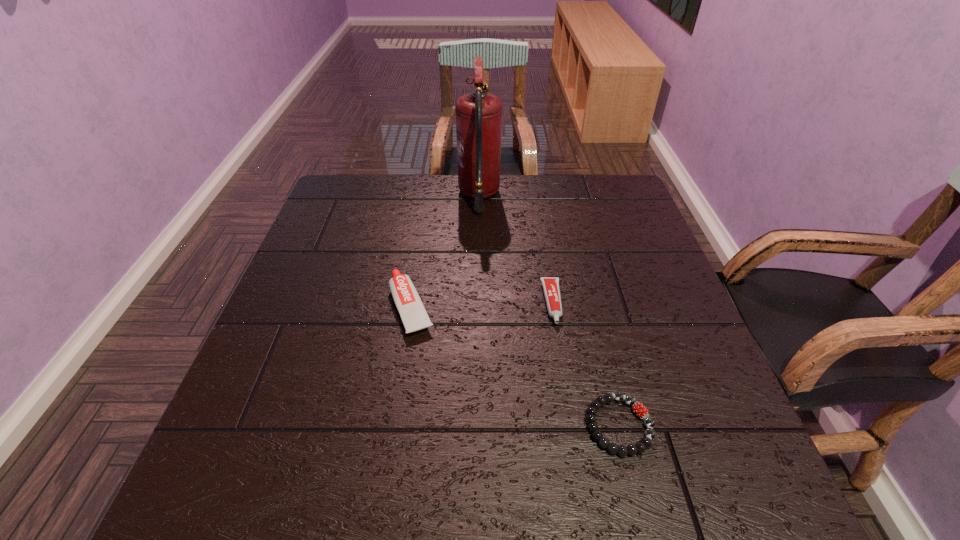
Find the location of a particular element. This screenshot has height=540, width=960. vacant region at the far left corner of the desktop is located at coordinates (326, 213).

In the image, there is a desktop. Find the location of `free space at the far right corner`. free space at the far right corner is located at coordinates tap(615, 191).

The height and width of the screenshot is (540, 960). Identify the location of empty location between the leftmost object and the farthest object. (445, 251).

I want to click on empty location between the third tallest object and the rightmost object, so click(x=586, y=364).

Image resolution: width=960 pixels, height=540 pixels. I want to click on free space between the nearest object and the second tallest object, so click(x=516, y=366).

Locate an element on the screen. vacant region between the rightmost object and the right toothpaste is located at coordinates point(586,364).

The width and height of the screenshot is (960, 540). Find the location of `free space between the nearest object and the third tallest object`. free space between the nearest object and the third tallest object is located at coordinates (586, 364).

Where is `free space that is in between the third shortest object and the third object from right to left`? free space that is in between the third shortest object and the third object from right to left is located at coordinates (445, 251).

Where is `free area in between the farthest object and the third tallest object`? The width and height of the screenshot is (960, 540). free area in between the farthest object and the third tallest object is located at coordinates (516, 249).

The height and width of the screenshot is (540, 960). In order to click on vacant space that is in between the left toothpaste and the second object from left to right in this screenshot , I will do `click(445, 251)`.